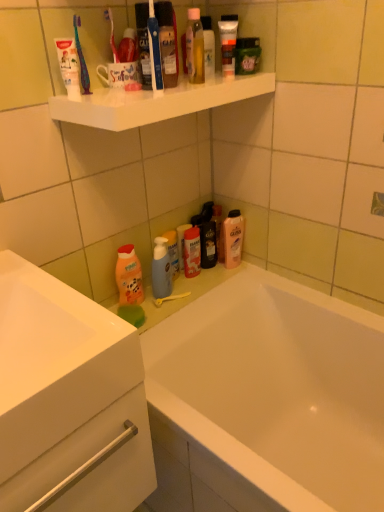
Question: Is orange matte bottle at lower left a part of translucent plastic pump bottle at lower center, the 1th toiletry from the bottom?

Choices:
 (A) yes
 (B) no

Answer: (B)

Question: Considering the relative sizes of translucent plastic pump bottle at lower center, placed as the second toiletry when sorted from back to front, and orange matte bottle at lower left in the image provided, is translucent plastic pump bottle at lower center, placed as the second toiletry when sorted from back to front, taller than orange matte bottle at lower left?

Choices:
 (A) yes
 (B) no

Answer: (B)

Question: From the image's perspective, would you say translucent plastic pump bottle at lower center, the fourth toiletry when ordered from right to left, is shown under orange matte bottle at lower left?

Choices:
 (A) yes
 (B) no

Answer: (B)

Question: Does translucent plastic pump bottle at lower center, the 1th toiletry from the bottom, lie behind orange matte bottle at lower left?

Choices:
 (A) yes
 (B) no

Answer: (A)

Question: Does translucent plastic pump bottle at lower center, placed as the second toiletry when sorted from back to front, have a lesser width compared to orange matte bottle at lower left?

Choices:
 (A) yes
 (B) no

Answer: (A)

Question: Would you say matte plastic tube at upper center, arranged as the third toiletry when viewed from the left, is to the left or to the right of white glossy bathtub at lower center in the picture?

Choices:
 (A) right
 (B) left

Answer: (B)

Question: Is matte plastic tube at upper center, which is the third toiletry from bottom to top, wider or thinner than white glossy bathtub at lower center?

Choices:
 (A) thin
 (B) wide

Answer: (A)

Question: Based on their sizes in the image, would you say matte plastic tube at upper center, positioned as the 4th toiletry in back-to-front order, is bigger or smaller than white glossy bathtub at lower center?

Choices:
 (A) big
 (B) small

Answer: (B)

Question: In the image, is matte plastic tube at upper center, which appears as the first toiletry when viewed from the front, positioned in front of or behind white glossy bathtub at lower center?

Choices:
 (A) behind
 (B) front

Answer: (A)

Question: From the image's perspective, is white glossy shelf at upper center located above or below white matte toothpaste at upper left?

Choices:
 (A) above
 (B) below

Answer: (B)

Question: Is point (150, 115) closer or farther from the camera than point (79, 67)?

Choices:
 (A) closer
 (B) farther

Answer: (A)

Question: Looking at the image, does white glossy shelf at upper center seem bigger or smaller compared to white matte toothpaste at upper left?

Choices:
 (A) small
 (B) big

Answer: (B)

Question: From a real-world perspective, relative to white matte toothpaste at upper left, is white glossy shelf at upper center vertically above or below?

Choices:
 (A) below
 (B) above

Answer: (A)

Question: Considering their positions, is translucent plastic pump bottle at lower center, the fourth toiletry when ordered from right to left, located in front of or behind matte plastic tube at upper center, positioned as the 4th toiletry in back-to-front order?

Choices:
 (A) behind
 (B) front

Answer: (A)

Question: Considering the positions of translucent plastic pump bottle at lower center, the 1th toiletry viewed from the left, and matte plastic tube at upper center, arranged as the third toiletry when viewed from the left, in the image, is translucent plastic pump bottle at lower center, the 1th toiletry viewed from the left, taller or shorter than matte plastic tube at upper center, arranged as the third toiletry when viewed from the left,?

Choices:
 (A) short
 (B) tall

Answer: (B)